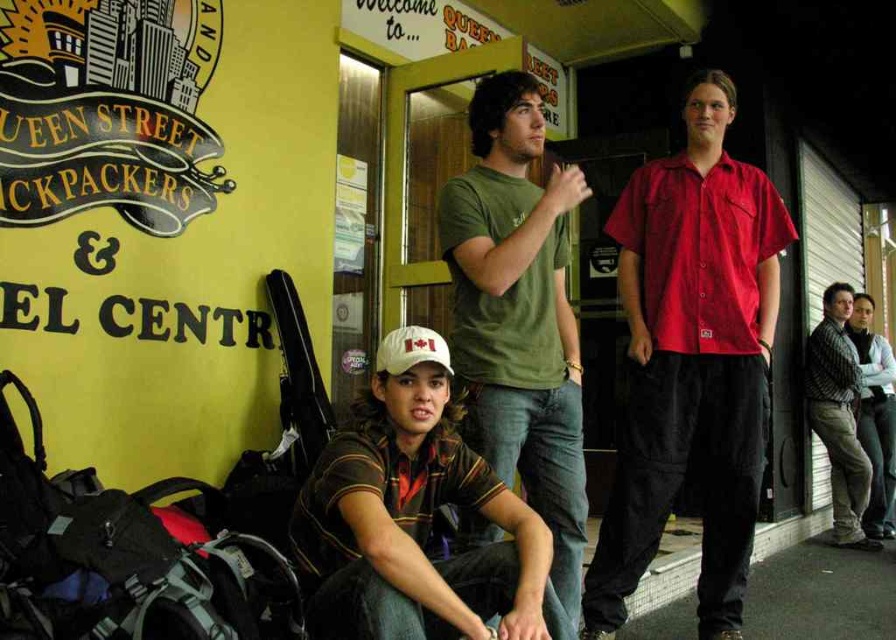
Question: Can you confirm if green matte t-shirt at center is smaller than white fabric baseball cap at center?

Choices:
 (A) yes
 (B) no

Answer: (B)

Question: Which object is farther from the camera taking this photo?

Choices:
 (A) white fabric baseball cap at center
 (B) brown striped shirt at center
 (C) green matte t-shirt at center

Answer: (A)

Question: Which point is farther to the camera?

Choices:
 (A) (397, 328)
 (B) (829, 336)
 (C) (464, 426)

Answer: (B)

Question: Can you confirm if red cotton shirt at center is bigger than white fabric baseball cap at center?

Choices:
 (A) yes
 (B) no

Answer: (A)

Question: Among these points, which one is farthest from the camera?

Choices:
 (A) (425, 337)
 (B) (722, 307)
 (C) (398, 400)

Answer: (B)

Question: Can you confirm if striped shirt at right is smaller than white fabric baseball cap at center?

Choices:
 (A) no
 (B) yes

Answer: (A)